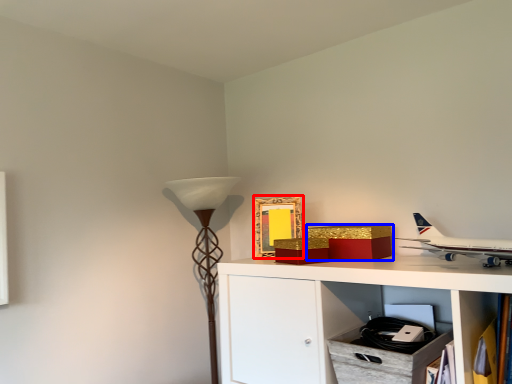
Question: Which point is closer to the camera, picture frame (highlighted by a red box) or box (highlighted by a blue box)?

Choices:
 (A) picture frame
 (B) box

Answer: (B)